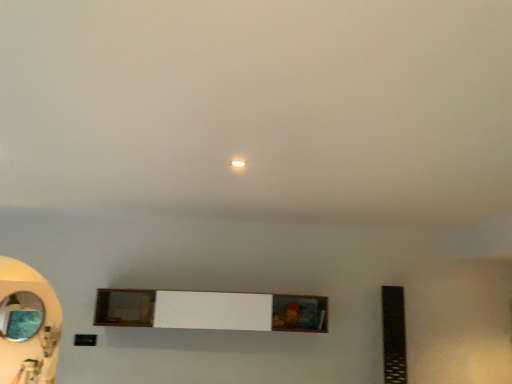
Question: Considering the relative sizes of white wood shelf at center and oval glass mirror at left in the image provided, is white wood shelf at center shorter than oval glass mirror at left?

Choices:
 (A) yes
 (B) no

Answer: (A)

Question: Could you tell me if white wood shelf at center is facing oval glass mirror at left?

Choices:
 (A) yes
 (B) no

Answer: (B)

Question: Does white wood shelf at center have a smaller size compared to oval glass mirror at left?

Choices:
 (A) yes
 (B) no

Answer: (B)

Question: Can you confirm if white wood shelf at center is taller than oval glass mirror at left?

Choices:
 (A) no
 (B) yes

Answer: (A)

Question: Would you say white wood shelf at center is a long distance from oval glass mirror at left?

Choices:
 (A) yes
 (B) no

Answer: (B)

Question: Is oval glass mirror at left located within white wood shelf at center?

Choices:
 (A) no
 (B) yes

Answer: (A)

Question: Is oval glass mirror at left outside of white wood shelf at center?

Choices:
 (A) yes
 (B) no

Answer: (A)

Question: Can you confirm if oval glass mirror at left is smaller than white wood shelf at center?

Choices:
 (A) yes
 (B) no

Answer: (A)

Question: Is oval glass mirror at left to the left of white wood shelf at center from the viewer's perspective?

Choices:
 (A) yes
 (B) no

Answer: (A)

Question: Could white wood shelf at center be considered to be inside oval glass mirror at left?

Choices:
 (A) yes
 (B) no

Answer: (B)

Question: Considering the relative sizes of oval glass mirror at left and white wood shelf at center in the image provided, is oval glass mirror at left taller than white wood shelf at center?

Choices:
 (A) yes
 (B) no

Answer: (A)

Question: From a real-world perspective, does oval glass mirror at left stand above white wood shelf at center?

Choices:
 (A) no
 (B) yes

Answer: (A)

Question: Based on their sizes in the image, would you say white wood shelf at center is bigger or smaller than oval glass mirror at left?

Choices:
 (A) small
 (B) big

Answer: (B)